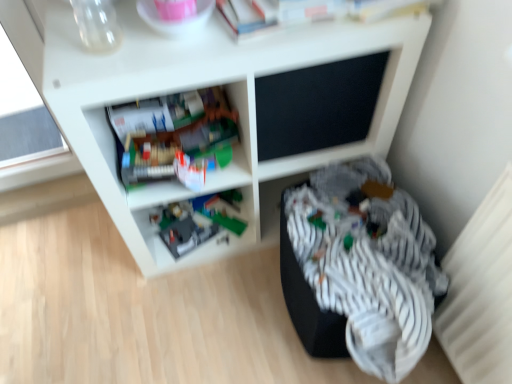
Find the location of a particular element. The height and width of the screenshot is (384, 512). empty space that is ontop of plastic gray toy at lower center, positioned as the first shelf in back-to-front order is located at coordinates (180, 222).